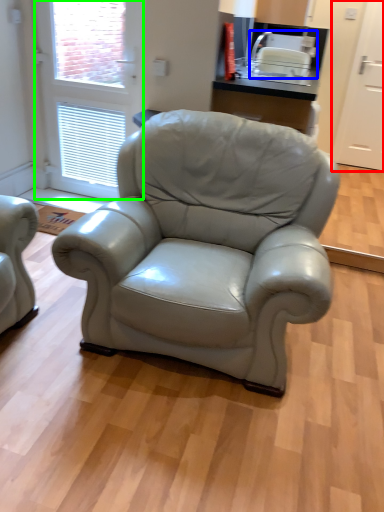
Question: Which is nearer to the screen door (highlighted by a red box)? appliance (highlighted by a blue box) or screen door (highlighted by a green box).

Choices:
 (A) appliance
 (B) screen door

Answer: (A)